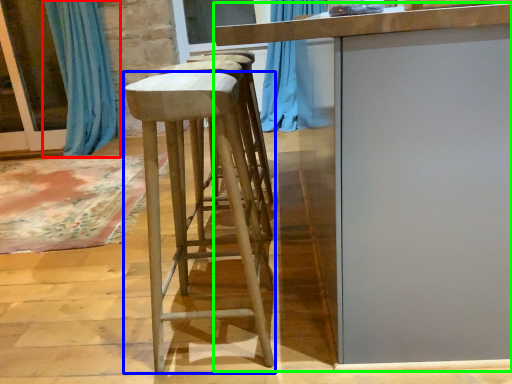
Question: Estimate the real-world distances between objects in this image. Which object is farther from curtain (highlighted by a red box), stool (highlighted by a blue box) or table (highlighted by a green box)?

Choices:
 (A) stool
 (B) table

Answer: (B)